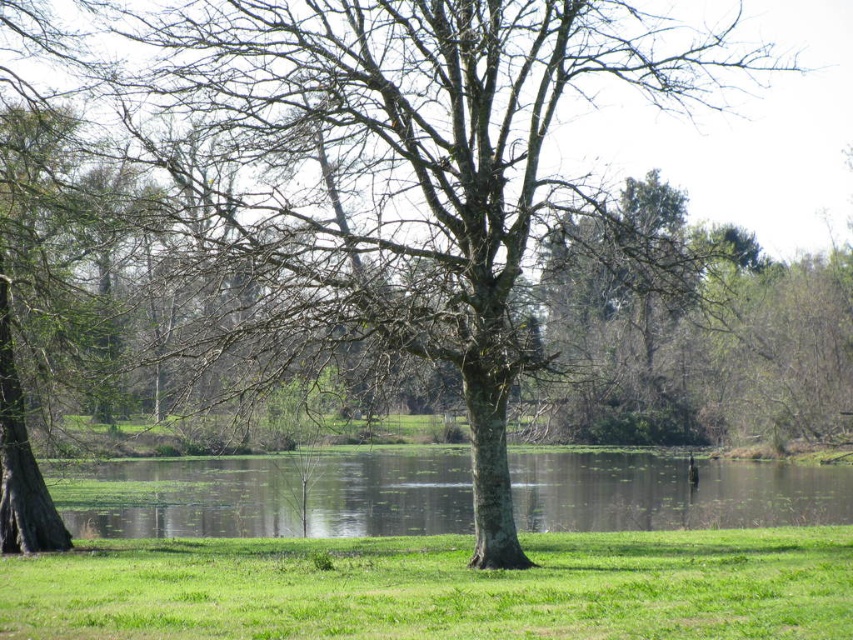
Question: Can you confirm if green grassy at center is positioned to the right of green reflective water at center?

Choices:
 (A) yes
 (B) no

Answer: (B)

Question: Which of the following is the closest to the observer?

Choices:
 (A) green reflective water at center
 (B) green grassy at center

Answer: (B)

Question: Is green grassy at center positioned in front of green reflective water at center?

Choices:
 (A) yes
 (B) no

Answer: (A)

Question: Where is green grassy at center located in relation to green reflective water at center in the image?

Choices:
 (A) above
 (B) below

Answer: (A)